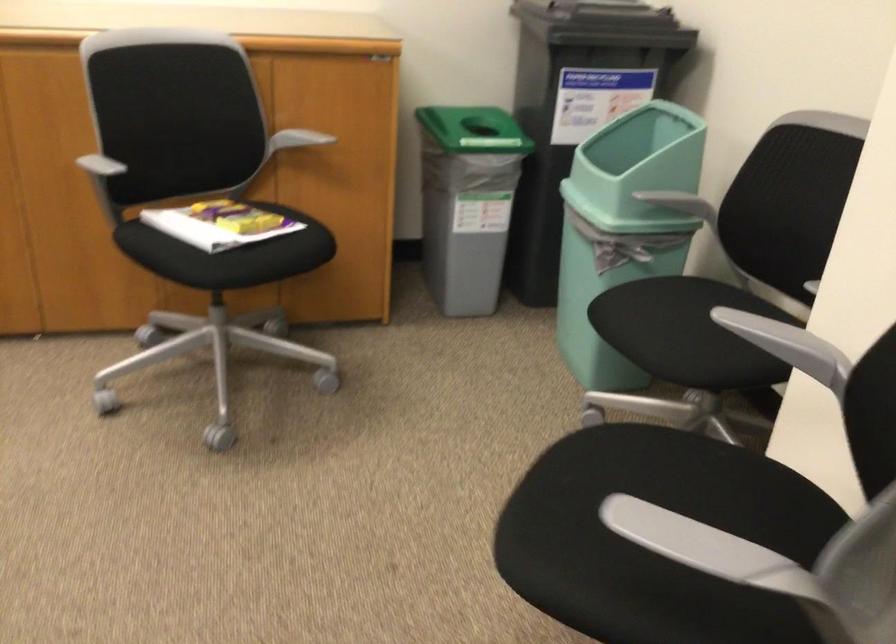
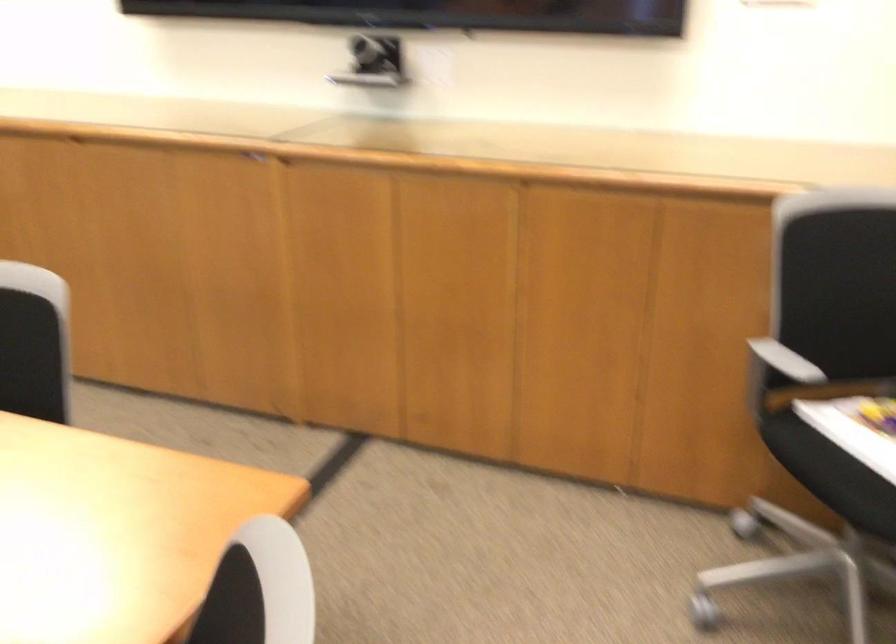
Find the pixel in the second image that matches point 192,219 in the first image.

(857, 428)